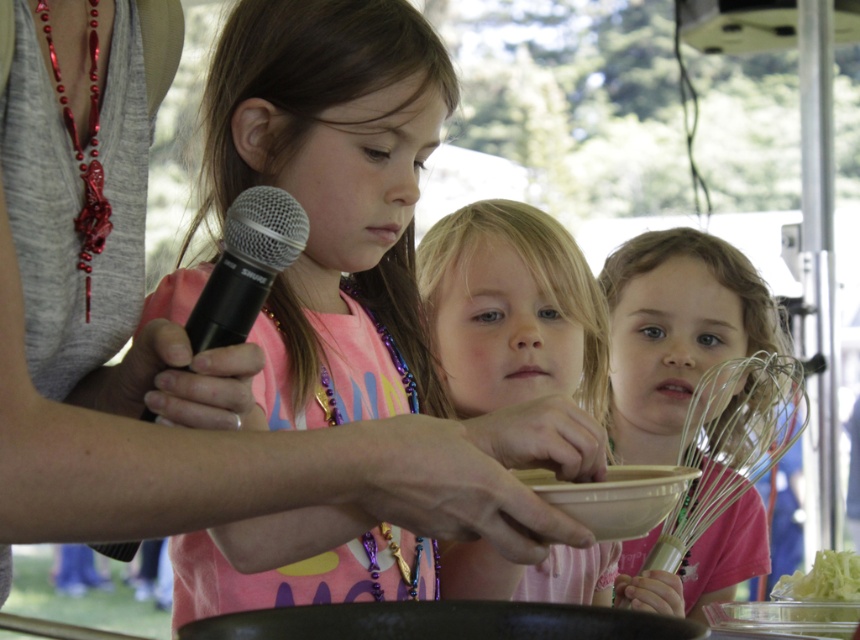
From the picture: Is metallic silver whisk at lower right closer to camera compared to black matte frying pan at center?

No.

Who is positioned more to the left, metallic silver whisk at lower right or black matte frying pan at center?

Positioned to the left is black matte frying pan at center.

Between point (716, 502) and point (496, 628), which one is positioned behind?

Positioned behind is point (716, 502).

Locate an element on the screen. metallic silver whisk at lower right is located at coordinates (731, 444).

Does black matte frying pan at center have a smaller size compared to white matte bowl at center?

Correct, black matte frying pan at center occupies less space than white matte bowl at center.

Which is in front, point (692, 621) or point (544, 490)?

Point (692, 621)

This screenshot has width=860, height=640. I want to click on black matte frying pan at center, so click(x=441, y=621).

Does smooth pink shirt at center have a lesser width compared to black plastic microphone at upper center?

Incorrect, smooth pink shirt at center's width is not less than black plastic microphone at upper center's.

The width and height of the screenshot is (860, 640). What are the coordinates of `smooth pink shirt at center` in the screenshot? It's located at (511, 310).